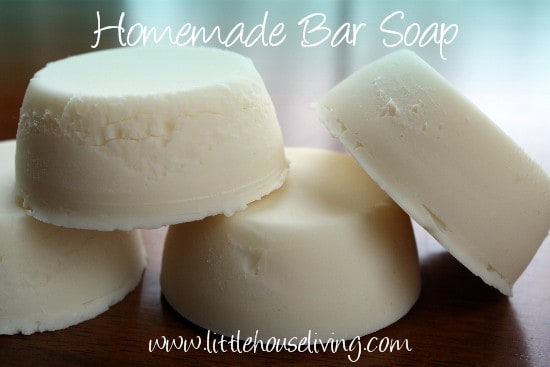
What are the coordinates of `soap` in the screenshot? It's located at (72, 245).